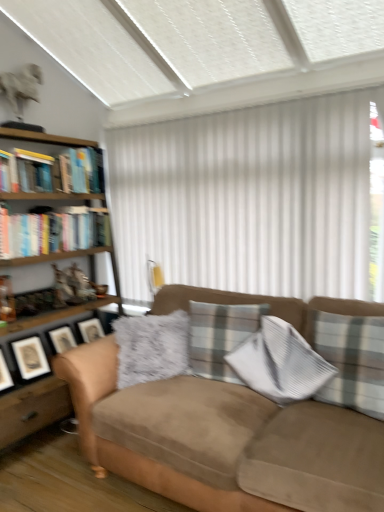
Question: In terms of height, does matte black picture frame at left look taller or shorter compared to white vertical blinds at center?

Choices:
 (A) short
 (B) tall

Answer: (A)

Question: Looking at their shapes, would you say matte black picture frame at left is wider or thinner than white vertical blinds at center?

Choices:
 (A) thin
 (B) wide

Answer: (B)

Question: Based on their relative distances, which object is farther from the suede couch at center?

Choices:
 (A) woodenmaterial/texturebookcase at left
 (B) matte black picture frame at left
 (C) hardcover books at left, which ranks as the first book in bottom-to-top order
 (D) plaid fabric pillow at right, which appears as the first pillow when viewed from the right
 (E) plaid fabric pillow at center, which appears as the 1th pillow when viewed from the left

Answer: (C)

Question: Which object is positioned farthest from the suede couch at center?

Choices:
 (A) plaid fabric pillow at right, which is the second pillow from left to right
 (B) matte black picture frame at left
 (C) hardcover book at upper left, the fourth book in the bottom-to-top sequence
 (D) woodenmaterial/texturebookcase at left
 (E) hardcover books at left, which ranks as the first book in bottom-to-top order

Answer: (C)